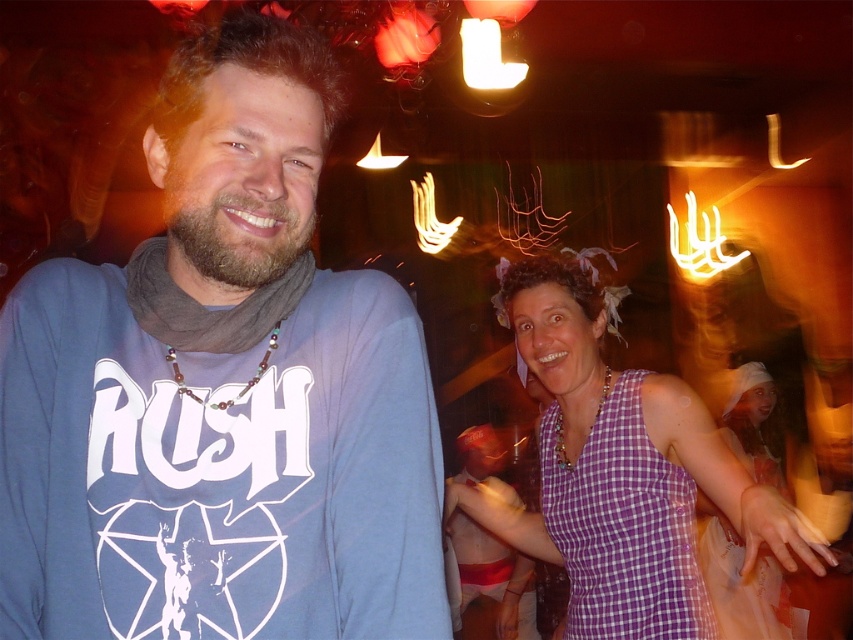
You are a photographer at the party and want to capture a closeup of the blue cotton shirt at left. The camera you are using has a minimum focusing distance of 1 meter. Can you take the photo without moving closer than 1 meter?

The blue cotton shirt at left is 82.61 centimeters away from the camera, which is less than 1 meter. Therefore, the camera cannot focus on it because it is too close.

You are a photographer at the event and want to capture both the blue cotton shirt at left and the purple checkered dress at center in a single frame. Given their sizes, which one should you focus on to ensure both are clearly visible?

The blue cotton shirt at left is smaller in size compared to the purple checkered dress at center. To ensure both are clearly visible, focus on the larger purple checkered dress at center while positioning the camera to include the smaller blue cotton shirt at left within the frame.

You are at a party and want to find someone wearing a blue cotton shirt at left and a purple checkered dress at center. Which clothing item is shorter in length?

The blue cotton shirt at left is shorter than the purple checkered dress at center.